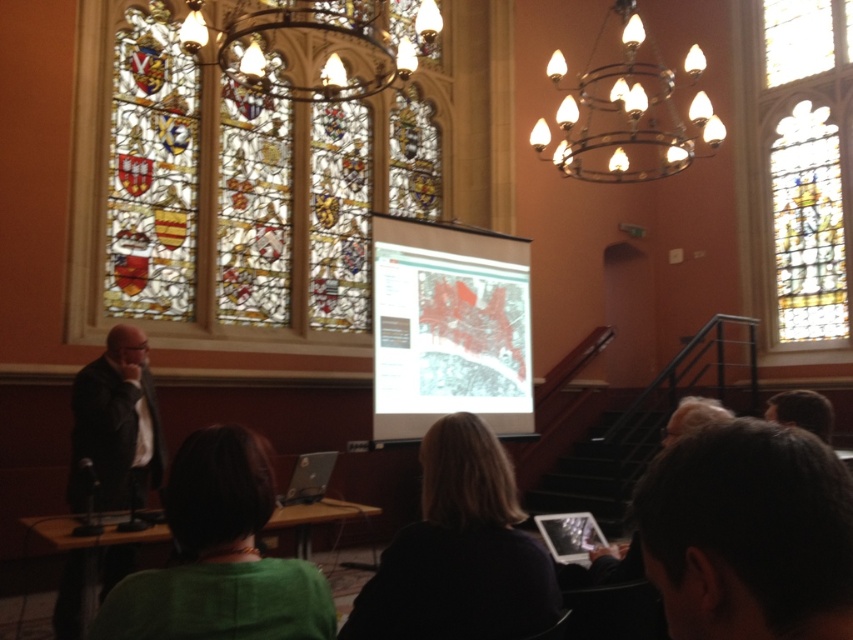
You are attending a lecture in this room and want to take a photo of the stained glass at upper left without including the dark brown leather jacket at left in the frame. Is this possible given their positions?

The stained glass at upper left is positioned over the dark brown leather jacket at left, so you can take a photo by angling your camera upwards to capture the stained glass while avoiding the jacket below it.

Based on the photo, you are attending a lecture in this room and notice two elements in the scene. One is the stained glass at upper left and the other is dark brown hair at center. Which of these two elements is taller?

The stained glass at upper left is taller than the dark brown hair at center.